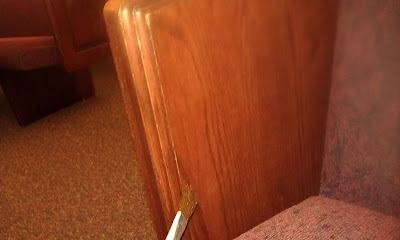
Identify the location of upper left corder of wooden panel. The image size is (400, 240). (110, 9).